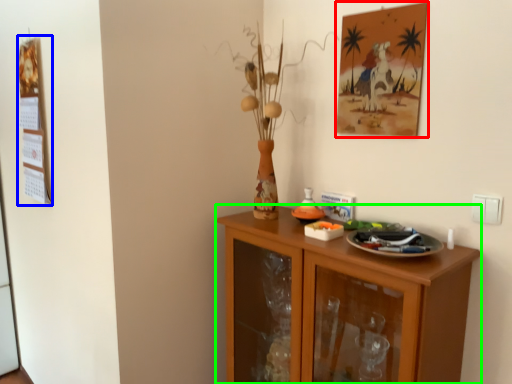
Question: Considering the real-world distances, which object is farthest from picture frame (highlighted by a red box)? bulletin board (highlighted by a blue box) or cabinetry (highlighted by a green box)?

Choices:
 (A) bulletin board
 (B) cabinetry

Answer: (A)